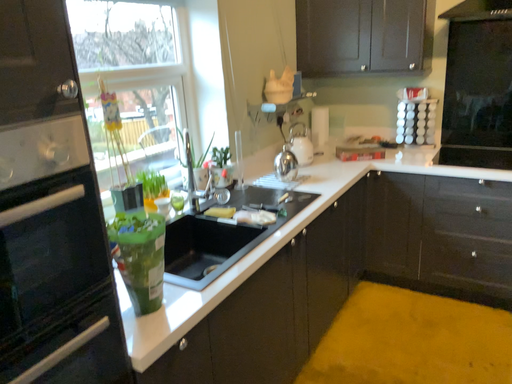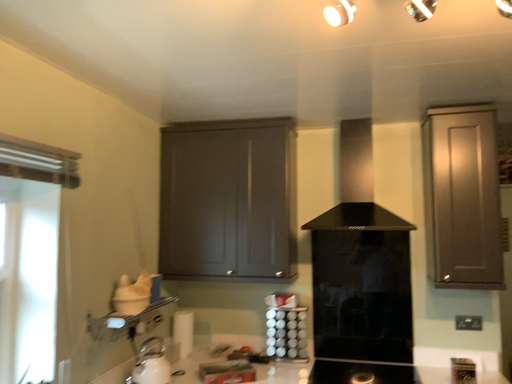
Question: How did the camera likely rotate when shooting the video?

Choices:
 (A) rotated upward
 (B) rotated downward

Answer: (A)